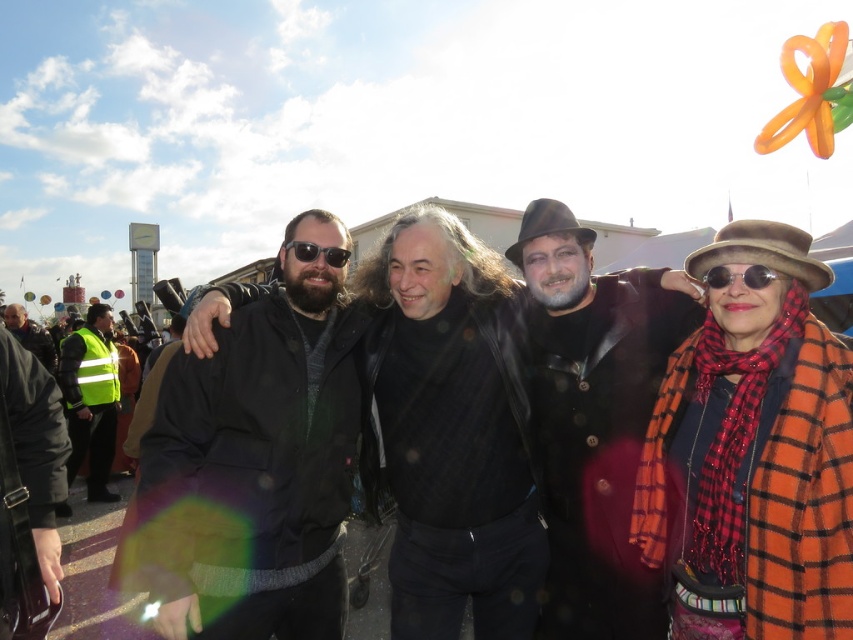
Question: Is high-visibility yellow vest at left wider than matte black jacket at left?

Choices:
 (A) yes
 (B) no

Answer: (B)

Question: Does black leather jacket at center have a lesser width compared to high-visibility yellow vest at left?

Choices:
 (A) no
 (B) yes

Answer: (B)

Question: Estimate the real-world distances between objects in this image. Which object is farther from the black leather jacket at center?

Choices:
 (A) black matte jacket at left
 (B) high-visibility yellow vest at left
 (C) matte black sunglasses at center

Answer: (B)

Question: Which object is positioned closest to the matte black sunglasses at center?

Choices:
 (A) orange plaid coat at right
 (B) black leather jacket at center
 (C) high-visibility yellow vest at left
 (D) matte black jacket at left

Answer: (B)

Question: Is black leather jacket at center bigger than high-visibility yellow vest at left?

Choices:
 (A) no
 (B) yes

Answer: (A)

Question: Estimate the real-world distances between objects in this image. Which object is closer to the matte black jacket at left?

Choices:
 (A) black leather jacket at center
 (B) sunglasses at right
 (C) black matte jacket at left
 (D) matte black sunglasses at center

Answer: (C)